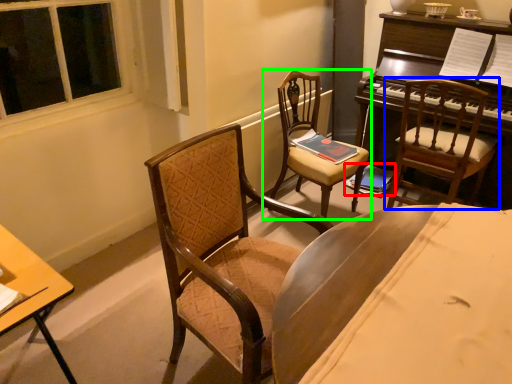
Question: Considering the real-world distances, which object is closest to book (highlighted by a red box)? chair (highlighted by a blue box) or chair (highlighted by a green box).

Choices:
 (A) chair
 (B) chair

Answer: (A)